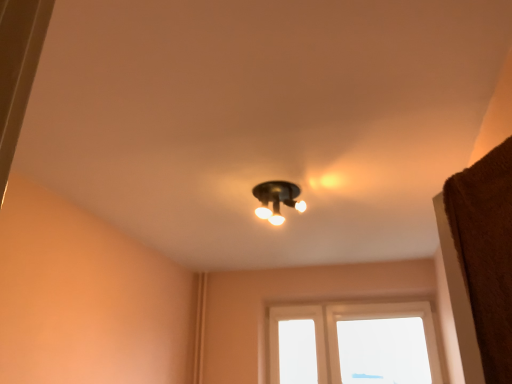
The height and width of the screenshot is (384, 512). What do you see at coordinates (353, 344) in the screenshot?
I see `transparent glass window at center` at bounding box center [353, 344].

Image resolution: width=512 pixels, height=384 pixels. What are the coordinates of `transparent glass window at center` in the screenshot? It's located at (353, 344).

In order to face transparent glass window at center, should I rotate leftwards or rightwards?

Turn right approximately 16.415 degrees to face it.

Find the location of a particular element. This screenshot has width=512, height=384. matte black light fixture at center is located at coordinates (277, 199).

In order to face matte black light fixture at center, should I rotate leftwards or rightwards?

Turn right approximately 3.058 degrees to face it.

Describe the element at coordinates (277, 199) in the screenshot. I see `matte black light fixture at center` at that location.

You are a GUI agent. You are given a task and a screenshot of the screen. Output one action in this format:
    pyautogui.click(x=<x>, y=<y>)
    Task: Click on the transparent glass window at center
    The image size is (512, 384).
    Given the screenshot: What is the action you would take?
    pyautogui.click(x=353, y=344)

Considering the relative positions of transparent glass window at center and matte black light fixture at center in the image provided, is transparent glass window at center to the left or to the right of matte black light fixture at center?

Based on their positions, transparent glass window at center is located to the right of matte black light fixture at center.

Which is behind, transparent glass window at center or matte black light fixture at center?

transparent glass window at center.

Does point (281, 334) come in front of point (266, 212)?

No, it is not.

From the image's perspective, is transparent glass window at center located above matte black light fixture at center?

No.

From a real-world perspective, is transparent glass window at center positioned above or below matte black light fixture at center?

Clearly, from a real-world perspective, transparent glass window at center is below matte black light fixture at center.

Is transparent glass window at center wider than matte black light fixture at center?

In fact, transparent glass window at center might be narrower than matte black light fixture at center.

Can you confirm if transparent glass window at center is shorter than matte black light fixture at center?

No.

Considering the relative sizes of transparent glass window at center and matte black light fixture at center in the image provided, is transparent glass window at center bigger than matte black light fixture at center?

Correct, transparent glass window at center is larger in size than matte black light fixture at center.

Is transparent glass window at center outside of matte black light fixture at center?

Yes, transparent glass window at center is outside of matte black light fixture at center.

Is transparent glass window at center far away from matte black light fixture at center?

transparent glass window at center is far away from matte black light fixture at center.

Is transparent glass window at center positioned with its back to matte black light fixture at center?

No, transparent glass window at center is not facing the opposite direction of matte black light fixture at center.

How different are the orientations of transparent glass window at center and matte black light fixture at center in degrees?

1.31 degrees separate the facing orientations of transparent glass window at center and matte black light fixture at center.

Find the location of a particular element. Image resolution: width=512 pixels, height=384 pixels. lamp above the transparent glass window at center (from a real-world perspective) is located at coordinates (277, 199).

Considering the positions of objects matte black light fixture at center and transparent glass window at center in the image provided, who is more to the left, matte black light fixture at center or transparent glass window at center?

Positioned to the left is matte black light fixture at center.

Is matte black light fixture at center in front of or behind transparent glass window at center in the image?

matte black light fixture at center is positioned closer to the viewer than transparent glass window at center.

Does point (305, 207) come farther from viewer compared to point (423, 367)?

No.

Looking at this image, from the image's perspective, between matte black light fixture at center and transparent glass window at center, who is located below?

transparent glass window at center, from the image's perspective.

From a real-world perspective, is matte black light fixture at center beneath transparent glass window at center?

No, from a real-world perspective, matte black light fixture at center is not below transparent glass window at center.

Considering the sizes of matte black light fixture at center and transparent glass window at center in the image, is matte black light fixture at center wider or thinner than transparent glass window at center?

matte black light fixture at center is wider than transparent glass window at center.

Who is shorter, matte black light fixture at center or transparent glass window at center?

Standing shorter between the two is matte black light fixture at center.

Looking at the image, does matte black light fixture at center seem bigger or smaller compared to transparent glass window at center?

In the image, matte black light fixture at center appears to be smaller than transparent glass window at center.

Can we say matte black light fixture at center lies outside transparent glass window at center?

That's correct, matte black light fixture at center is outside of transparent glass window at center.

Is matte black light fixture at center with transparent glass window at center?

No, matte black light fixture at center is not touching transparent glass window at center.

Is matte black light fixture at center facing away from transparent glass window at center?

No, matte black light fixture at center is not facing the opposite direction of transparent glass window at center.

How far apart are matte black light fixture at center and transparent glass window at center?

3.12 meters.

Find the location of a particular element. Image resolution: width=512 pixels, height=384 pixels. lamp located on the left of transparent glass window at center is located at coordinates (277, 199).

This screenshot has width=512, height=384. What are the coordinates of `window below the matte black light fixture at center (from a real-world perspective)` in the screenshot? It's located at tap(353, 344).

The width and height of the screenshot is (512, 384). In order to click on lamp that is above the transparent glass window at center (from a real-world perspective) in this screenshot , I will do `click(277, 199)`.